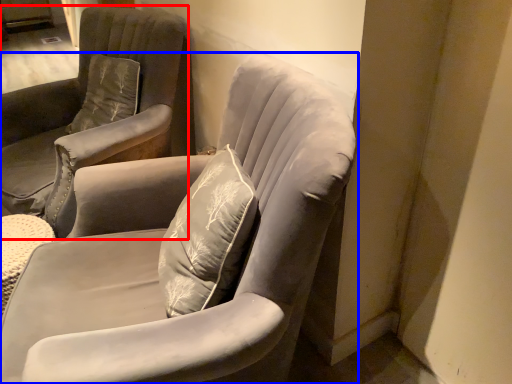
Question: Among these objects, which one is nearest to the camera, chair (highlighted by a red box) or chair (highlighted by a blue box)?

Choices:
 (A) chair
 (B) chair

Answer: (B)